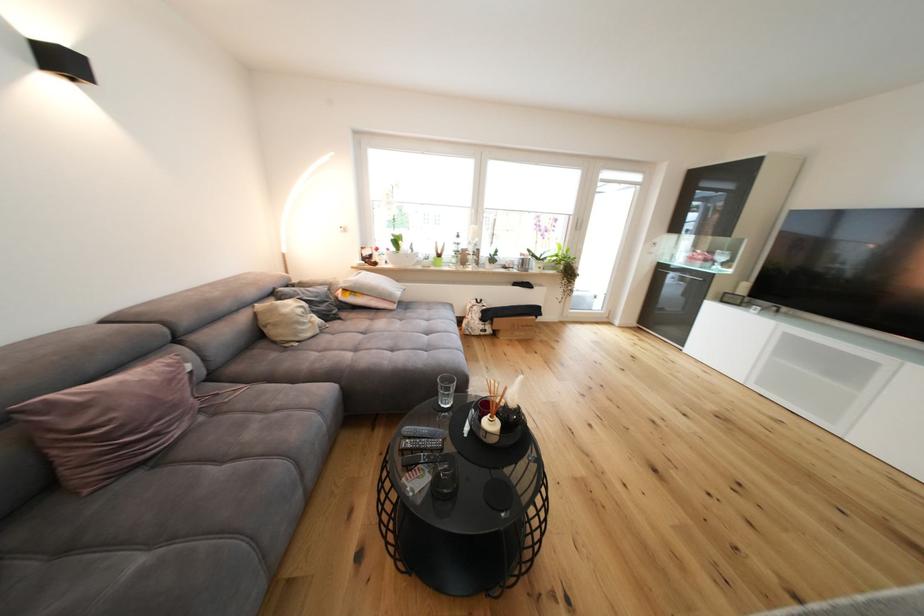
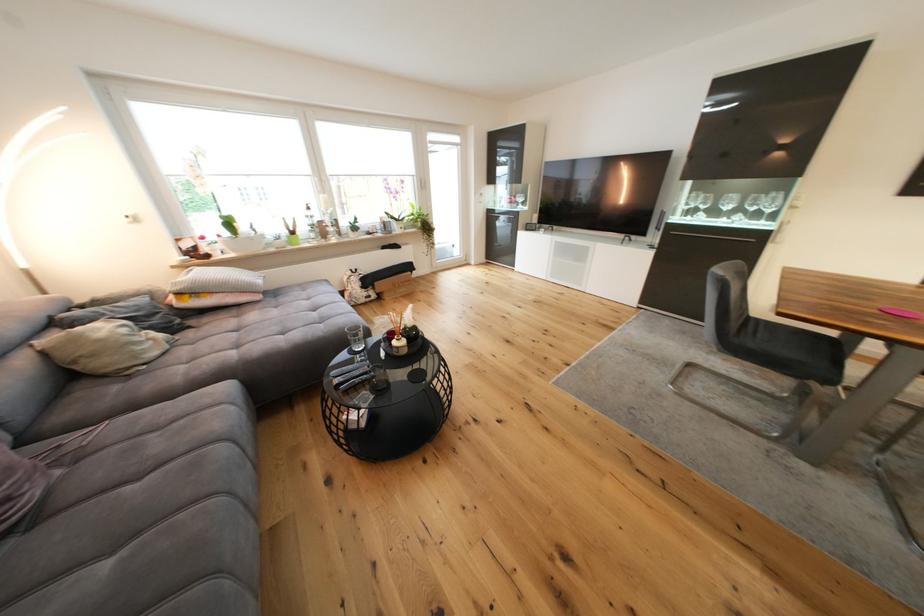
Locate, in the second image, the point that corresponds to (715,265) in the first image.

(523, 207)